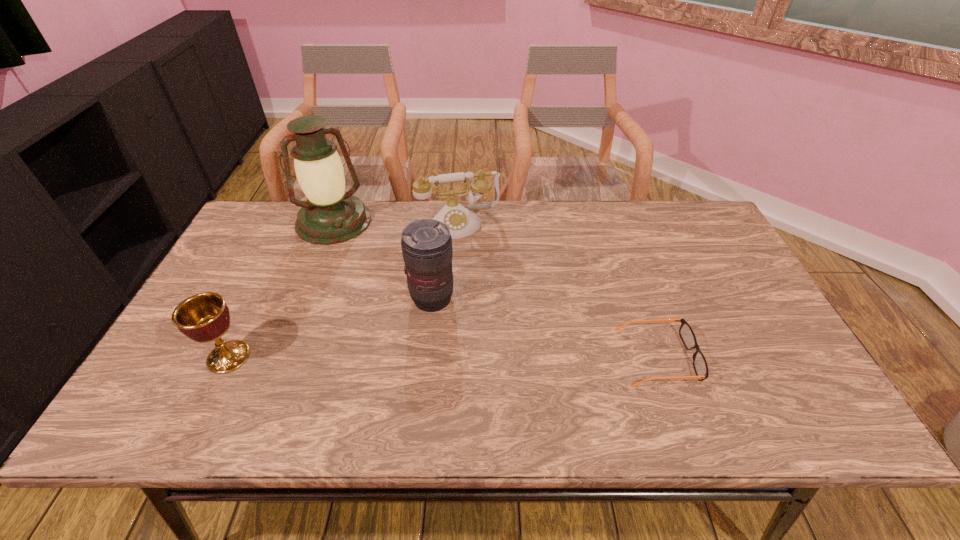
I want to click on chalice situated at the near edge, so click(204, 317).

The image size is (960, 540). What are the coordinates of `spectacles located at the near edge` in the screenshot? It's located at (686, 333).

I want to click on chalice that is positioned at the left edge, so click(204, 317).

In order to click on lantern present at the left edge in this screenshot , I will do `click(331, 216)`.

I want to click on object positioned at the far left corner, so click(x=331, y=216).

Identify the location of object positioned at the near left corner. 204,317.

Locate an element on the screen. vacant area at the far edge of the desktop is located at coordinates (401, 214).

In the image, there is a desktop. Where is `vacant region at the near edge`? This screenshot has height=540, width=960. vacant region at the near edge is located at coordinates (301, 392).

The height and width of the screenshot is (540, 960). I want to click on blank space at the left edge of the desktop, so click(236, 281).

Locate an element on the screen. The height and width of the screenshot is (540, 960). free region at the right edge of the desktop is located at coordinates (696, 284).